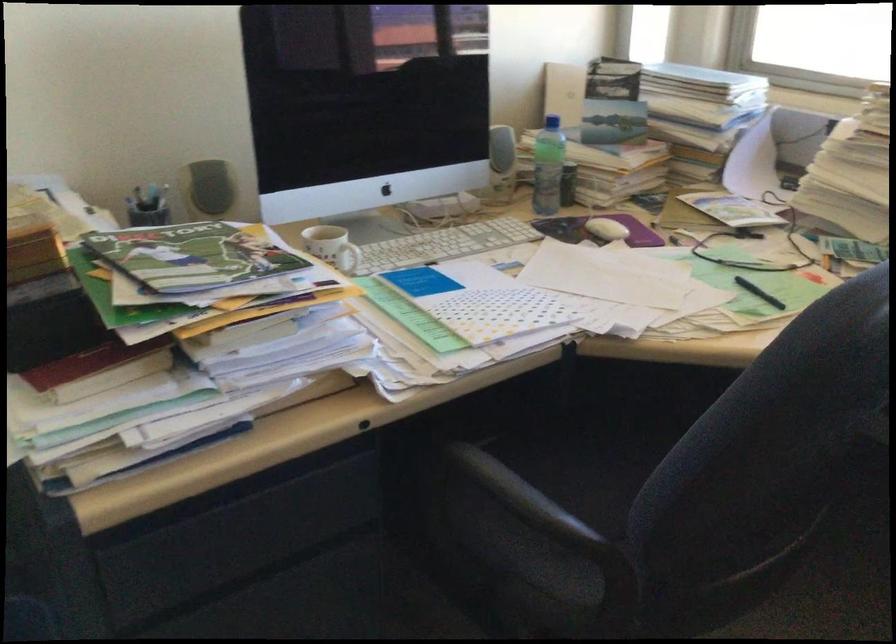
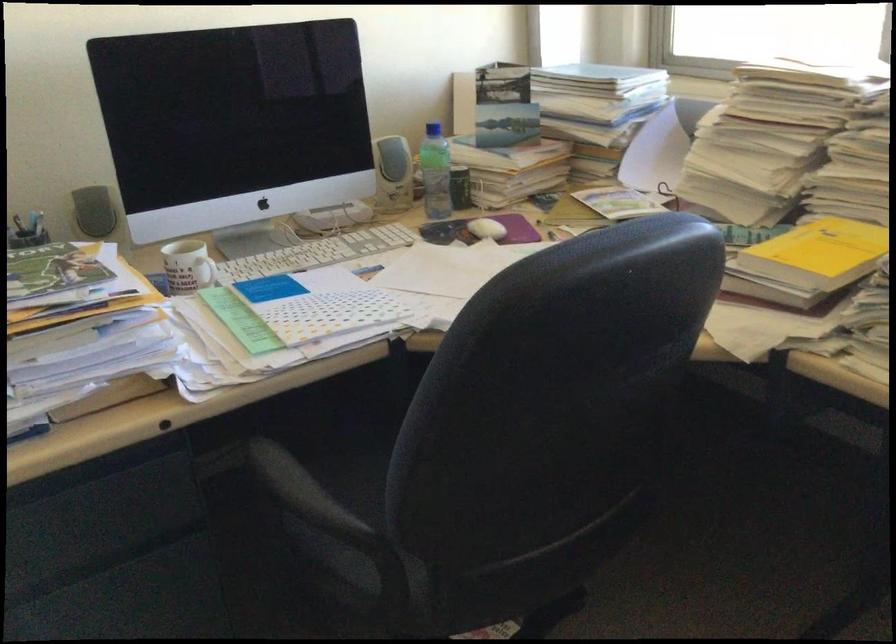
The point at (502, 166) is marked in the first image. Where is the corresponding point in the second image?

(392, 174)